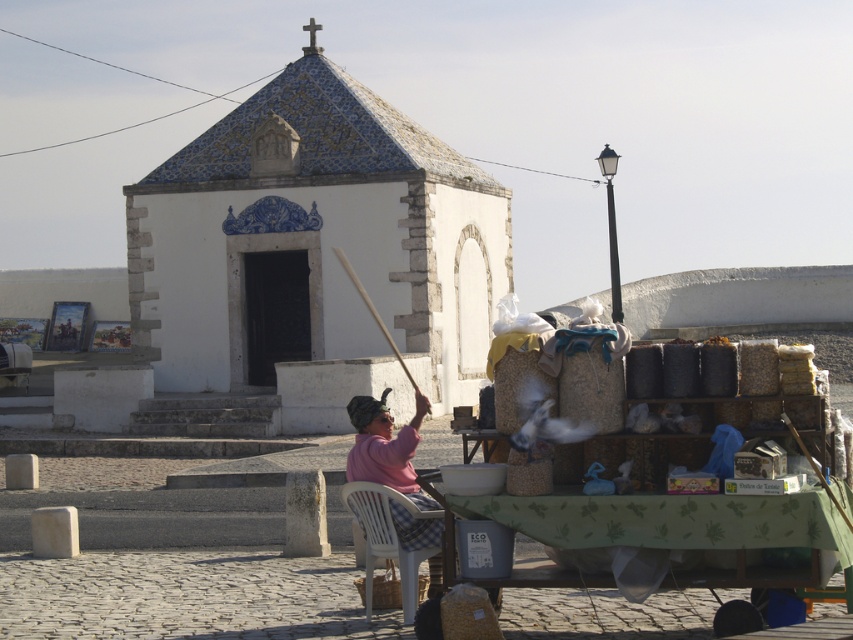
Is point (670, 500) positioned after point (415, 536)?

No, it is not.

Image resolution: width=853 pixels, height=640 pixels. In order to click on green fabric cart at center in this screenshot , I will do `click(668, 525)`.

The height and width of the screenshot is (640, 853). What are the coordinates of `green fabric cart at center` in the screenshot? It's located at (668, 525).

This screenshot has height=640, width=853. What are the coordinates of `green fabric cart at center` in the screenshot? It's located at (668, 525).

Is green fabric cart at center taller than white plastic chair at lower center?

No, green fabric cart at center is not taller than white plastic chair at lower center.

Is green fabric cart at center to the left of white plastic chair at lower center from the viewer's perspective?

In fact, green fabric cart at center is to the right of white plastic chair at lower center.

Which is in front, point (746, 516) or point (436, 548)?

Point (746, 516) is in front.

Identify the location of green fabric cart at center. Image resolution: width=853 pixels, height=640 pixels. (668, 525).

Consider the image. Does blue tiled chapel at center appear on the right side of pink woolen sweater at center?

In fact, blue tiled chapel at center is to the left of pink woolen sweater at center.

Is blue tiled chapel at center wider than pink woolen sweater at center?

Correct, the width of blue tiled chapel at center exceeds that of pink woolen sweater at center.

This screenshot has width=853, height=640. What are the coordinates of `blue tiled chapel at center` in the screenshot? It's located at (312, 241).

Where is `blue tiled chapel at center`? The width and height of the screenshot is (853, 640). blue tiled chapel at center is located at coordinates (312, 241).